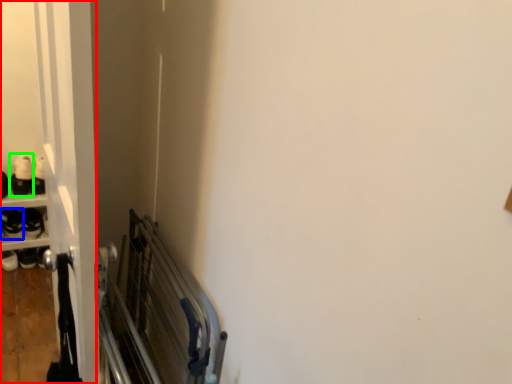
Question: Estimate the real-world distances between objects in this image. Which object is farther from door (highlighted by a red box), footwear (highlighted by a blue box) or footwear (highlighted by a green box)?

Choices:
 (A) footwear
 (B) footwear

Answer: (A)